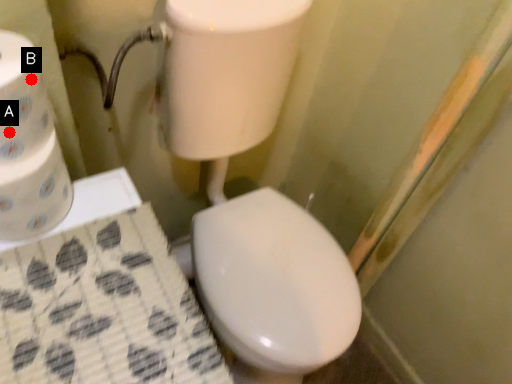
Question: Two points are circled on the image, labeled by A and B beside each circle. Which of the following is the farthest from the observer?

Choices:
 (A) A is further
 (B) B is further

Answer: (B)